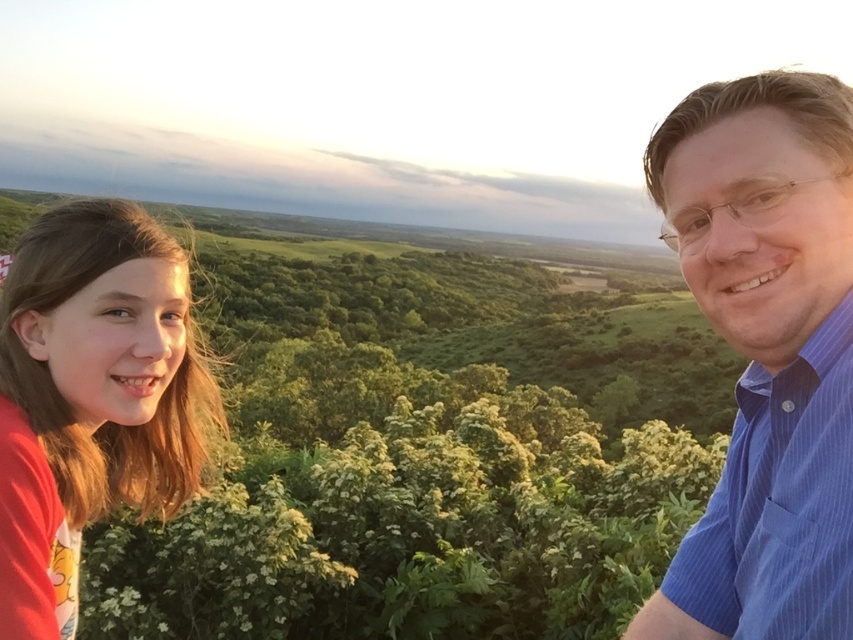
Does blue striped shirt at upper right appear under red cotton shirt at left?

Yes, blue striped shirt at upper right is below red cotton shirt at left.

The width and height of the screenshot is (853, 640). What do you see at coordinates (766, 353) in the screenshot?
I see `blue striped shirt at upper right` at bounding box center [766, 353].

What do you see at coordinates (766, 353) in the screenshot? The width and height of the screenshot is (853, 640). I see `blue striped shirt at upper right` at bounding box center [766, 353].

Identify the location of blue striped shirt at upper right. (766, 353).